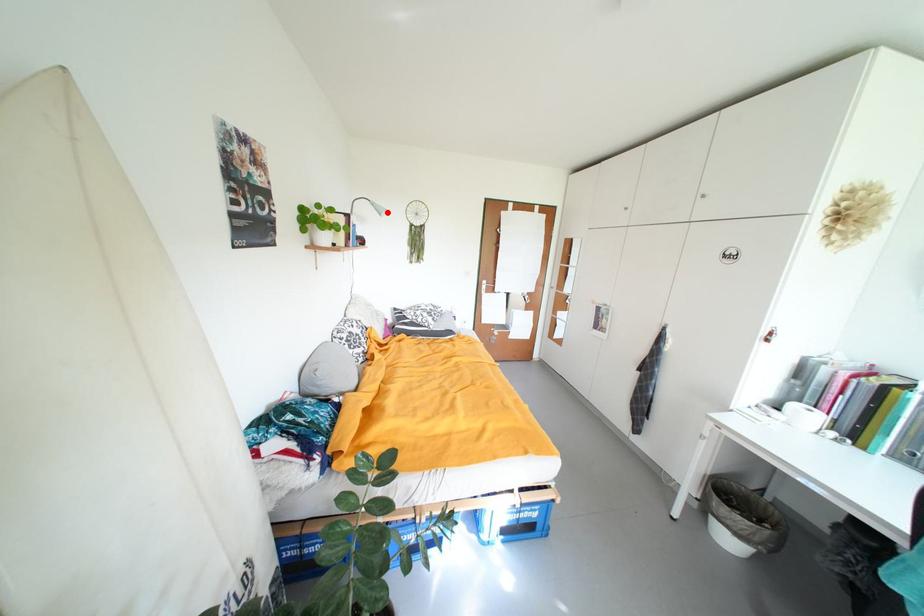
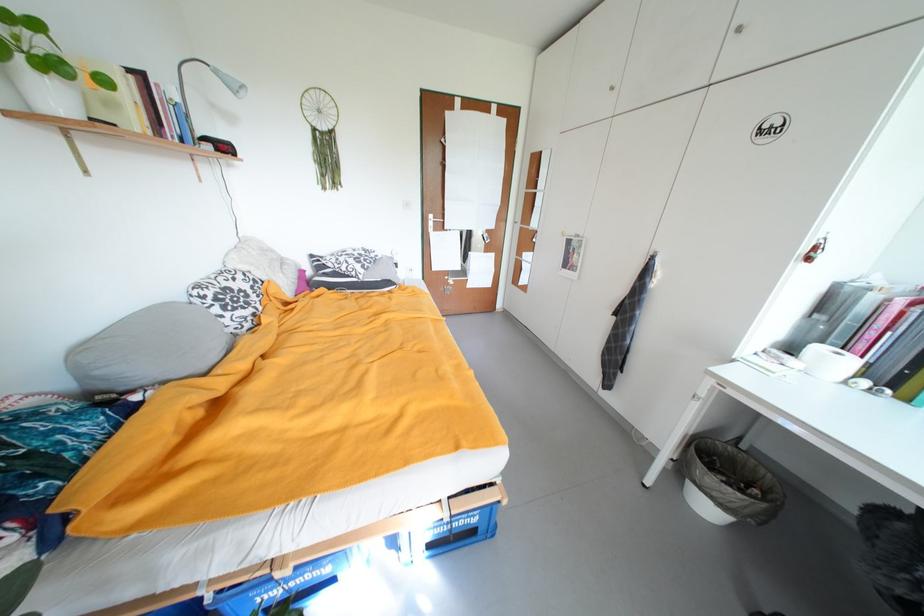
Find the pixel in the second image that matches the highlighted location in the first image.

(244, 90)